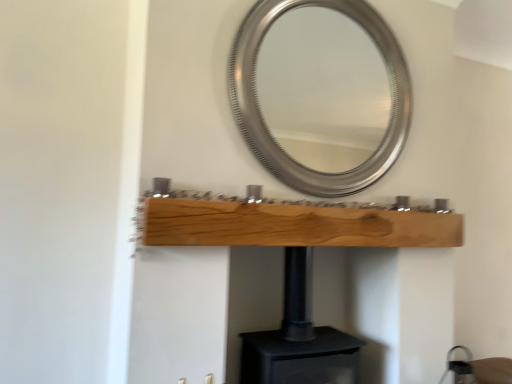
Question: Is black matte fireplace at center further to camera compared to silver metallic mirror at upper center?

Choices:
 (A) no
 (B) yes

Answer: (A)

Question: Considering the relative sizes of black matte fireplace at center and silver metallic mirror at upper center in the image provided, is black matte fireplace at center bigger than silver metallic mirror at upper center?

Choices:
 (A) no
 (B) yes

Answer: (B)

Question: From a real-world perspective, is black matte fireplace at center physically above silver metallic mirror at upper center?

Choices:
 (A) yes
 (B) no

Answer: (B)

Question: Considering the relative positions of black matte fireplace at center and silver metallic mirror at upper center in the image provided, is black matte fireplace at center in front of silver metallic mirror at upper center?

Choices:
 (A) yes
 (B) no

Answer: (A)

Question: Is black matte fireplace at center at the right side of silver metallic mirror at upper center?

Choices:
 (A) yes
 (B) no

Answer: (B)

Question: From the image's perspective, is black matte fireplace at center on silver metallic mirror at upper center?

Choices:
 (A) yes
 (B) no

Answer: (B)

Question: Is the position of natural wood plank at center less distant than that of black matte fireplace at center?

Choices:
 (A) no
 (B) yes

Answer: (B)

Question: Does natural wood plank at center appear on the left side of black matte fireplace at center?

Choices:
 (A) no
 (B) yes

Answer: (A)

Question: From the image's perspective, is natural wood plank at center under black matte fireplace at center?

Choices:
 (A) yes
 (B) no

Answer: (B)

Question: Is natural wood plank at center facing towards black matte fireplace at center?

Choices:
 (A) no
 (B) yes

Answer: (A)

Question: Is natural wood plank at center beside black matte fireplace at center?

Choices:
 (A) no
 (B) yes

Answer: (A)

Question: Is natural wood plank at center smaller than black matte fireplace at center?

Choices:
 (A) yes
 (B) no

Answer: (A)

Question: Can you confirm if silver metallic mirror at upper center is positioned to the left of black matte fireplace at center?

Choices:
 (A) no
 (B) yes

Answer: (A)